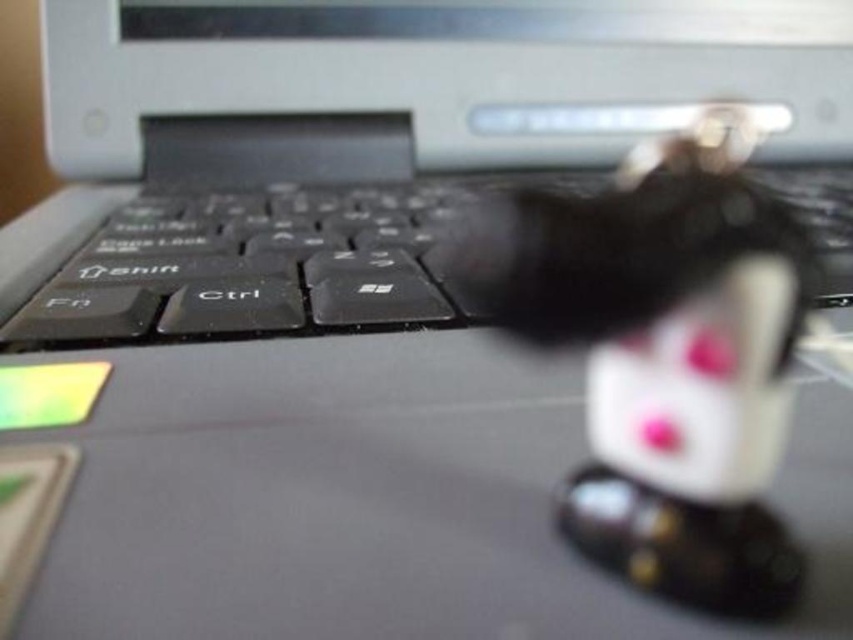
Looking at this image, does white glossy rabbit at center have a lesser height compared to black matte keyboard at center?

Correct, white glossy rabbit at center is not as tall as black matte keyboard at center.

Is point (485, 278) closer to viewer compared to point (416, 317)?

Yes, point (485, 278) is in front of point (416, 317).

Where is `white glossy rabbit at center`? Image resolution: width=853 pixels, height=640 pixels. white glossy rabbit at center is located at coordinates (665, 356).